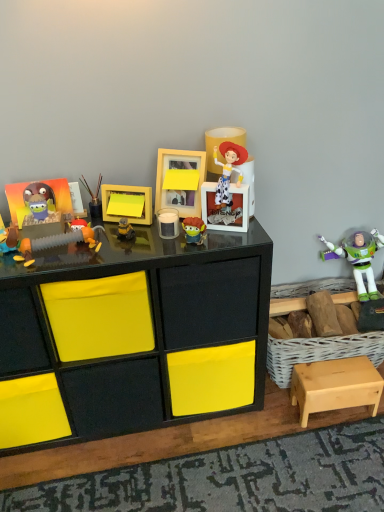
You are a GUI agent. You are given a task and a screenshot of the screen. Output one action in this format:
    pyautogui.click(x=<x>, y=<y>)
    Task: Click on the empty space that is ontop of light wood step stool at lower right (from a real-world perspective)
    The image size is (384, 512).
    Given the screenshot: What is the action you would take?
    pyautogui.click(x=334, y=365)